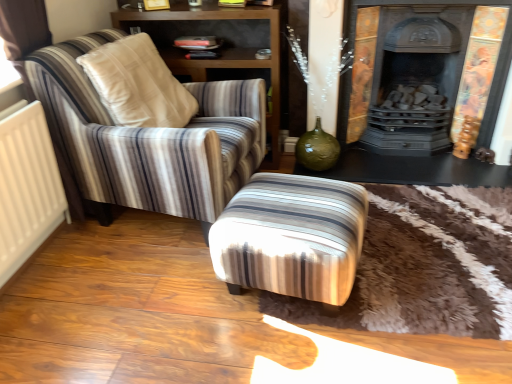
Question: Does dark gray cast iron fireplace at upper right have a lesser height compared to black glossy table at lower right?

Choices:
 (A) yes
 (B) no

Answer: (B)

Question: Can you confirm if dark gray cast iron fireplace at upper right is thinner than black glossy table at lower right?

Choices:
 (A) no
 (B) yes

Answer: (B)

Question: Would you say dark gray cast iron fireplace at upper right is a long distance from black glossy table at lower right?

Choices:
 (A) yes
 (B) no

Answer: (B)

Question: Are dark gray cast iron fireplace at upper right and black glossy table at lower right making contact?

Choices:
 (A) yes
 (B) no

Answer: (A)

Question: Does dark gray cast iron fireplace at upper right have a greater width compared to black glossy table at lower right?

Choices:
 (A) no
 (B) yes

Answer: (A)

Question: From a real-world perspective, is dark gray cast iron fireplace at upper right on black glossy table at lower right?

Choices:
 (A) no
 (B) yes

Answer: (B)

Question: Is striped fabric armchair at left shorter than black glossy table at lower right?

Choices:
 (A) yes
 (B) no

Answer: (B)

Question: From a real-world perspective, is striped fabric armchair at left on top of black glossy table at lower right?

Choices:
 (A) yes
 (B) no

Answer: (A)

Question: Considering the relative positions of striped fabric armchair at left and black glossy table at lower right in the image provided, is striped fabric armchair at left in front of black glossy table at lower right?

Choices:
 (A) yes
 (B) no

Answer: (A)

Question: From the image's perspective, does striped fabric armchair at left appear higher than black glossy table at lower right?

Choices:
 (A) yes
 (B) no

Answer: (A)

Question: Can you confirm if striped fabric armchair at left is thinner than black glossy table at lower right?

Choices:
 (A) no
 (B) yes

Answer: (A)

Question: From the image's perspective, is striped fabric armchair at left located beneath black glossy table at lower right?

Choices:
 (A) no
 (B) yes

Answer: (A)

Question: Can you confirm if striped fabric armchair at left is smaller than dark gray cast iron fireplace at upper right?

Choices:
 (A) no
 (B) yes

Answer: (A)